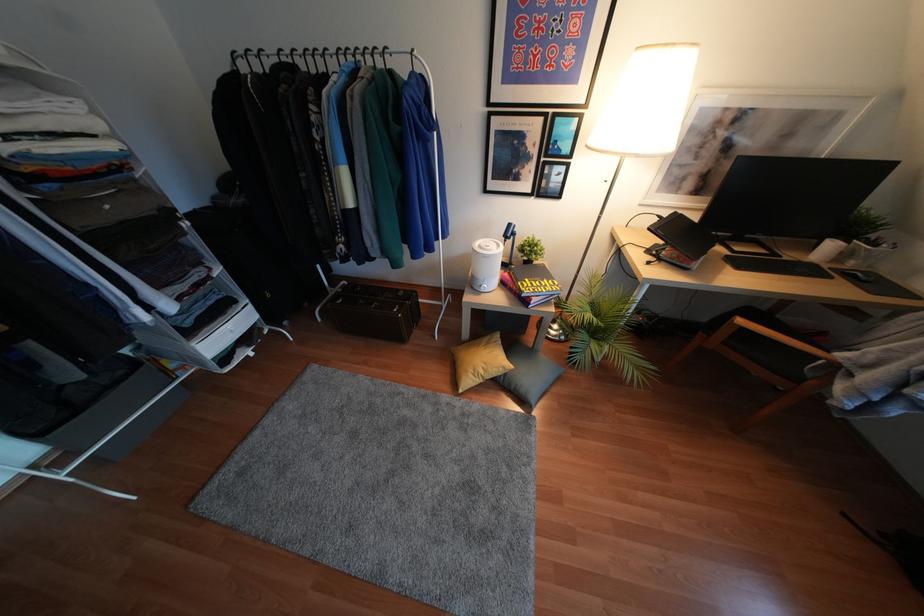
This screenshot has width=924, height=616. Identify the location of white pen holder. (485, 264).